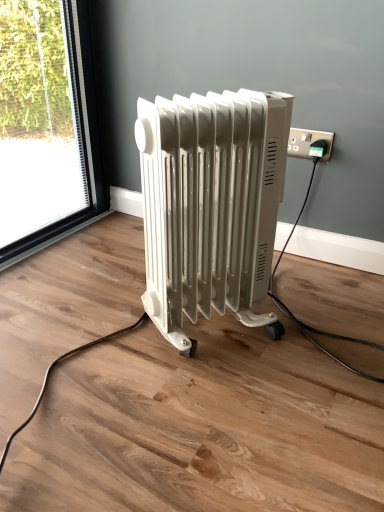
Locate an element on the screen. The height and width of the screenshot is (512, 384). white glossy radiator at center is located at coordinates 209,204.

Describe the element at coordinates (209, 204) in the screenshot. I see `white glossy radiator at center` at that location.

The height and width of the screenshot is (512, 384). I want to click on green plastic plug at upper right, so click(308, 142).

Describe the element at coordinates (308, 142) in the screenshot. I see `green plastic plug at upper right` at that location.

At what (x,y) coordinates should I click in order to perform the action: click on white glossy radiator at center. Please return your answer as a coordinate pair (x, y). Image resolution: width=384 pixels, height=512 pixels. Looking at the image, I should click on (209, 204).

Does white glossy radiator at center appear on the right side of green plastic plug at upper right?

No, white glossy radiator at center is not to the right of green plastic plug at upper right.

From the picture: Considering the relative positions of white glossy radiator at center and green plastic plug at upper right in the image provided, is white glossy radiator at center in front of green plastic plug at upper right?

Yes, white glossy radiator at center is in front of green plastic plug at upper right.

Is point (141, 150) closer or farther from the camera than point (306, 135)?

Point (141, 150) is closer to the camera than point (306, 135).

From the image's perspective, between white glossy radiator at center and green plastic plug at upper right, which one is located above?

green plastic plug at upper right, from the image's perspective.

From a real-world perspective, which is physically above, white glossy radiator at center or green plastic plug at upper right?

From a 3D spatial view, green plastic plug at upper right is above.

Considering the relative sizes of white glossy radiator at center and green plastic plug at upper right in the image provided, is white glossy radiator at center wider than green plastic plug at upper right?

Yes, white glossy radiator at center is wider than green plastic plug at upper right.

Considering the sizes of objects white glossy radiator at center and green plastic plug at upper right in the image provided, who is taller, white glossy radiator at center or green plastic plug at upper right?

white glossy radiator at center is taller.

Based on the photo, who is bigger, white glossy radiator at center or green plastic plug at upper right?

white glossy radiator at center.

Would you say white glossy radiator at center is outside green plastic plug at upper right?

Absolutely, white glossy radiator at center is external to green plastic plug at upper right.

In the scene shown: Are white glossy radiator at center and green plastic plug at upper right beside each other?

No, white glossy radiator at center is not making contact with green plastic plug at upper right.

Is green plastic plug at upper right at the back of white glossy radiator at center?

white glossy radiator at center is not turned away from green plastic plug at upper right.

How many degrees apart are the facing directions of white glossy radiator at center and green plastic plug at upper right?

white glossy radiator at center and green plastic plug at upper right are facing 57.4 degrees away from each other.

In the image, there is a white glossy radiator at center. Where is `power plugs and sockets above it (from the image's perspective)`? This screenshot has height=512, width=384. power plugs and sockets above it (from the image's perspective) is located at coordinates (308, 142).

Between green plastic plug at upper right and white glossy radiator at center, which one appears on the left side from the viewer's perspective?

white glossy radiator at center is more to the left.

Who is more distant, green plastic plug at upper right or white glossy radiator at center?

green plastic plug at upper right is more distant.

Considering the positions of points (329, 151) and (146, 307), is point (329, 151) closer to camera compared to point (146, 307)?

No.

From the image's perspective, which one is positioned lower, green plastic plug at upper right or white glossy radiator at center?

white glossy radiator at center appears lower in the image.

Looking at this image, from a real-world perspective, which object rests below the other?

white glossy radiator at center is physically lower.

Can you confirm if green plastic plug at upper right is thinner than white glossy radiator at center?

Indeed, green plastic plug at upper right has a lesser width compared to white glossy radiator at center.

Can you confirm if green plastic plug at upper right is shorter than white glossy radiator at center?

Yes.

Between green plastic plug at upper right and white glossy radiator at center, which one has larger size?

Bigger between the two is white glossy radiator at center.

Is green plastic plug at upper right inside or outside of white glossy radiator at center?

The correct answer is: outside.

Is green plastic plug at upper right directly adjacent to white glossy radiator at center?

green plastic plug at upper right and white glossy radiator at center are not in contact.

Could you tell me if green plastic plug at upper right is facing white glossy radiator at center?

Yes, green plastic plug at upper right is facing white glossy radiator at center.

How different are the orientations of green plastic plug at upper right and white glossy radiator at center in degrees?

They differ by 57.4 degrees in their facing directions.

Image resolution: width=384 pixels, height=512 pixels. I want to click on power plugs and sockets above the white glossy radiator at center (from a real-world perspective), so pos(308,142).

Locate an element on the screen. power plugs and sockets behind the white glossy radiator at center is located at coordinates (308, 142).

This screenshot has height=512, width=384. I want to click on radiator below the green plastic plug at upper right (from the image's perspective), so (x=209, y=204).